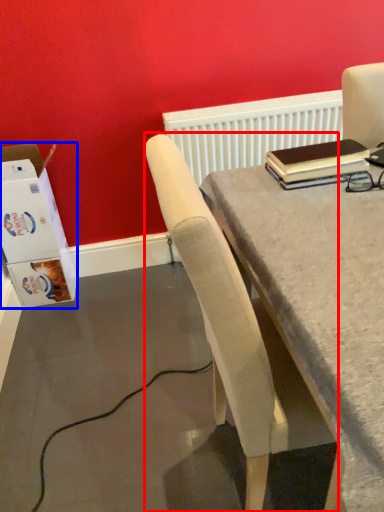
Question: Which object appears closest to the camera in this image, chair (highlighted by a red box) or box (highlighted by a blue box)?

Choices:
 (A) chair
 (B) box

Answer: (A)